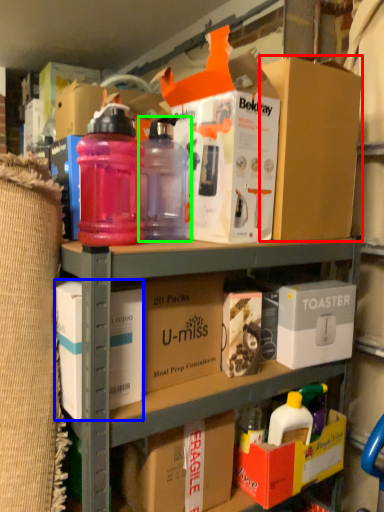
Question: Which is nearer to the box (highlighted by a red box)? box (highlighted by a blue box) or bottle (highlighted by a green box).

Choices:
 (A) box
 (B) bottle

Answer: (B)